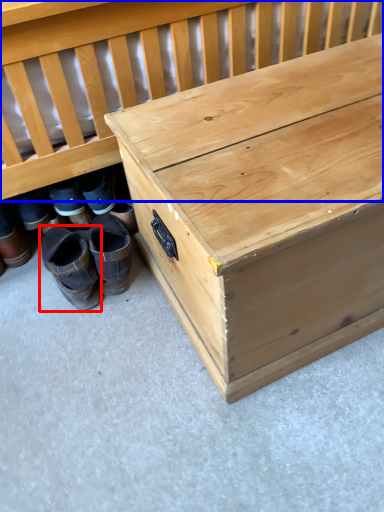
Question: Which object appears closest to the camera in this image, footwear (highlighted by a red box) or infant bed (highlighted by a blue box)?

Choices:
 (A) footwear
 (B) infant bed

Answer: (B)